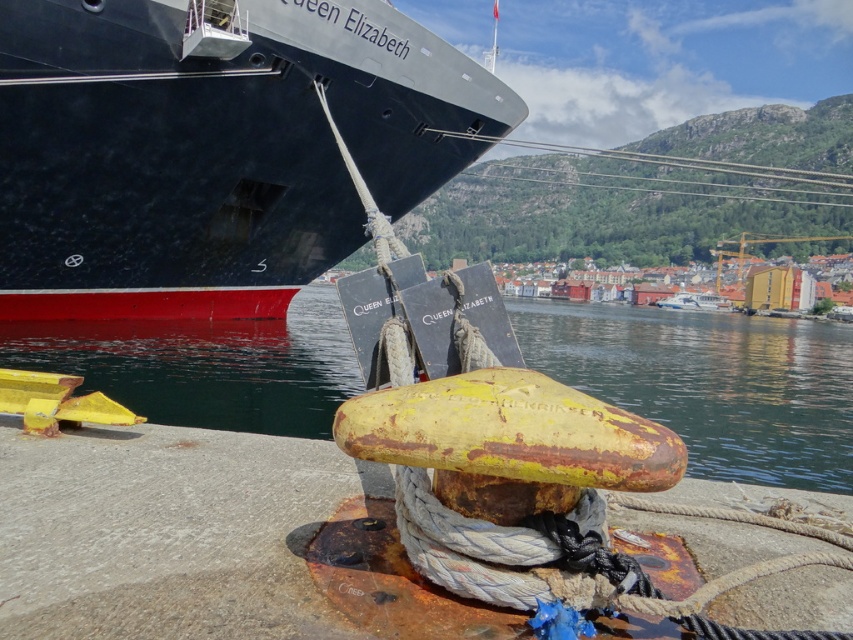
You are a sailor trying to secure the ship to the dock. You notice the shiny black ship at upper left and the yellow rusty water at lower center. Which object is smaller in size?

The shiny black ship at upper left is smaller in size compared to the yellow rusty water at lower center according to the description.

You are standing on the deck of the Queen Elizabeth ship and see two points marked on the ship. The first point is at coordinates point (100, 134) and the second point is at point (801, 396). From your current position, which point is closer to you?

Point (100, 134) is in front of point (801, 396), so the first point is closer to you.

You are a dock worker observing the shiny black ship at upper left and the yellow rusty water at lower center. Which object has a smaller width?

The shiny black ship at upper left has a smaller width than the yellow rusty water at lower center.